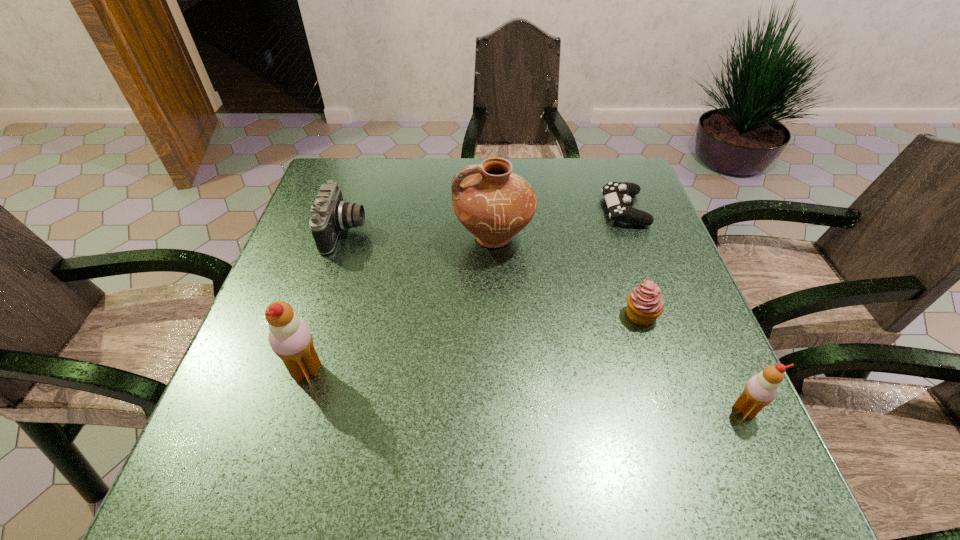
The width and height of the screenshot is (960, 540). Identify the location of free area in between the second nearest object and the control. (466, 291).

The image size is (960, 540). I want to click on free spot between the third shortest object and the left icecream, so click(x=326, y=302).

This screenshot has width=960, height=540. In order to click on unoccupied area between the left icecream and the fifth tallest object in this screenshot , I will do `click(474, 343)`.

What are the coordinates of `the fourth closest object to the control` in the screenshot? It's located at (330, 214).

Locate which object ranks fourth in proximity to the camera. Please provide its 2D coordinates. Your answer should be formatted as a tuple, i.e. [(x, y)], where the tuple contains the x and y coordinates of a point satisfying the conditions above.

[(617, 195)]

The height and width of the screenshot is (540, 960). In order to click on free location that satisfies the following two spatial constraints: 1. on the front-facing side of the camera; 2. on the side of the pottery with the handle in this screenshot , I will do `click(344, 238)`.

Locate an element on the screen. The height and width of the screenshot is (540, 960). blank area in the image that satisfies the following two spatial constraints: 1. on the side of the third object from left to right with the handle; 2. on the front-facing side of the camera is located at coordinates (493, 232).

I want to click on vacant region that satisfies the following two spatial constraints: 1. on the front-facing side of the camera; 2. on the side of the fourth object from right to left with the handle, so click(x=344, y=238).